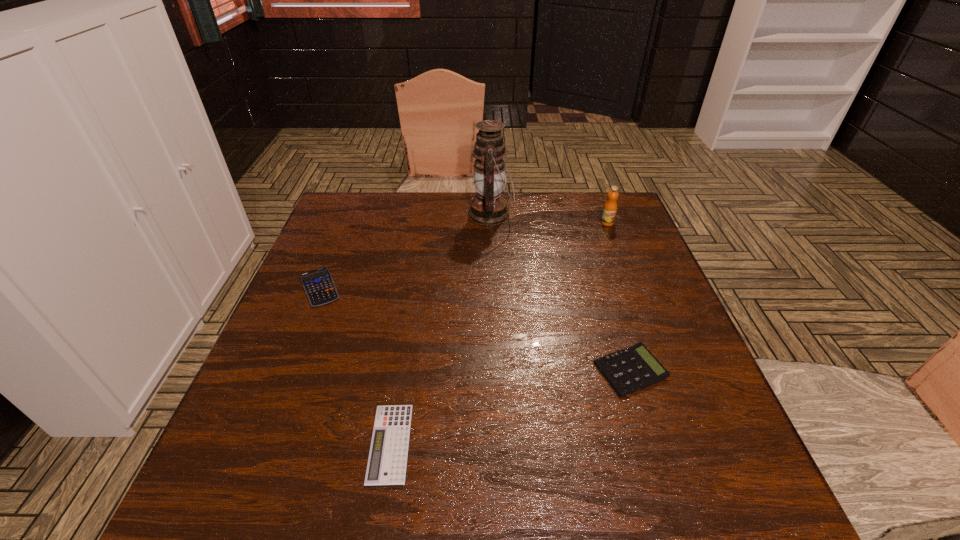
Locate an element on the screen. The image size is (960, 540). vacant position located on the front label of the orange juice is located at coordinates (619, 253).

Identify the location of vacant region located on the front of the second nearest calculator. The image size is (960, 540). (664, 480).

The width and height of the screenshot is (960, 540). I want to click on vacant space located on the back of the third farthest object, so click(351, 210).

Find the location of a particular element. free spot located on the back of the shortest object is located at coordinates (402, 372).

Where is `lantern that is at the far edge`? lantern that is at the far edge is located at coordinates (488, 208).

Find the location of a particular element. orange juice situated at the far edge is located at coordinates coord(609,211).

At what (x,y) coordinates should I click in order to perform the action: click on object that is at the near edge. Please return your answer as a coordinate pair (x, y). This screenshot has width=960, height=540. Looking at the image, I should click on (387, 460).

Where is `object at the left edge`? The image size is (960, 540). object at the left edge is located at coordinates (318, 284).

You are a GUI agent. You are given a task and a screenshot of the screen. Output one action in this format:
    pyautogui.click(x=<x>, y=<y>)
    Task: Click on the orange juice located at the right edge
    This screenshot has height=540, width=960.
    Given the screenshot: What is the action you would take?
    pyautogui.click(x=609, y=211)

Find the location of `calculator present at the right edge`. calculator present at the right edge is located at coordinates click(631, 369).